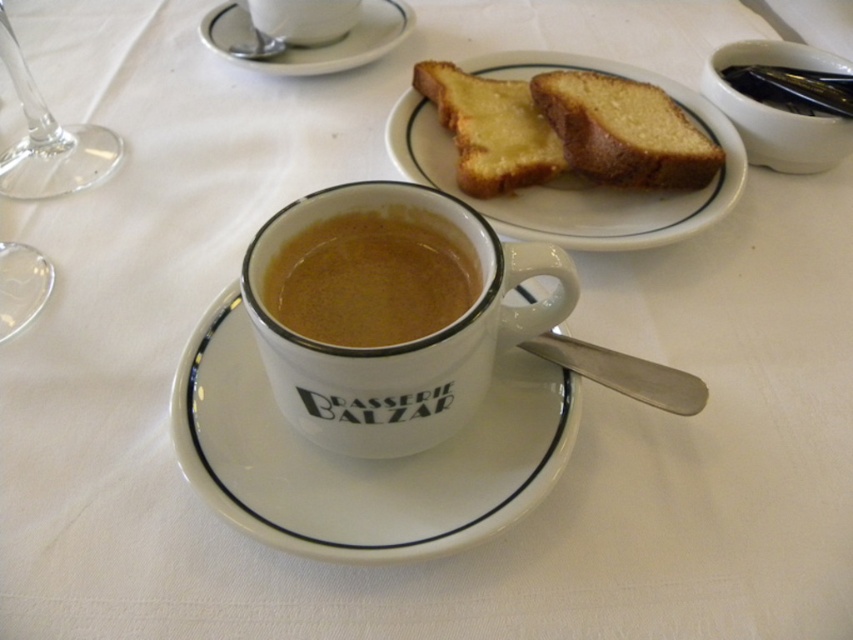
Question: Can you confirm if white ceramic mug at center is positioned to the right of brown matte cup at center?

Choices:
 (A) yes
 (B) no

Answer: (A)

Question: Is white ceramic mug at center above golden-brown toasted bread at upper center?

Choices:
 (A) no
 (B) yes

Answer: (A)

Question: Can you confirm if white ceramic saucer at upper center is bigger than white ceramic cup at center?

Choices:
 (A) yes
 (B) no

Answer: (A)

Question: Among these points, which one is nearest to the camera?

Choices:
 (A) (587, 138)
 (B) (370, 432)

Answer: (B)

Question: Which point appears farthest from the camera in this image?

Choices:
 (A) (340, 230)
 (B) (364, 396)
 (C) (219, 458)

Answer: (A)

Question: Which point is farther to the camera?

Choices:
 (A) (345, 435)
 (B) (566, 416)
 (C) (280, 13)

Answer: (C)